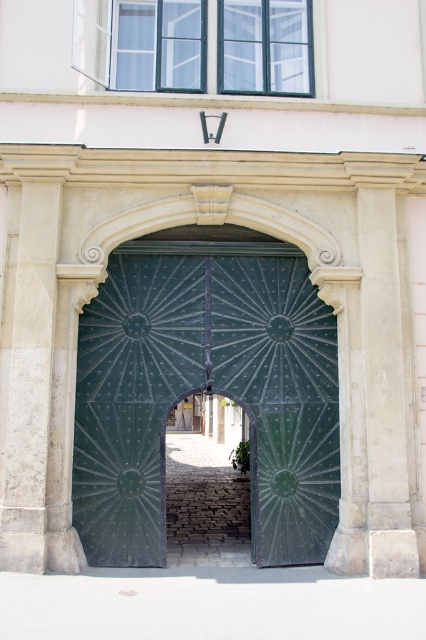
You are standing in front of the grand entrance and want to take a photo of both the white stone pillar at left and the white stone column at right. Which one should you focus on first to ensure both are in the frame?

The white stone pillar at left is positioned on the left side of the white stone column at right, so you should focus on the white stone pillar at left first to ensure both are in the frame.

You are a delivery person standing at the entrance of the building. You need to place a package that is 2 meters long on the ground between the green textured metal door at center and the security camera below the window. Will the package fit without overlapping either object?

The distance between the green textured metal door at center and the security camera below the window is 6.77 meters. Since the package is only 2 meters long, there is enough space for it to fit without overlapping either object.

You are standing in front of the grand entrance of the historic building. There is a point marked at coordinates [207,390]. What object is located at this point?

The point at coordinates [207,390] indicates the green textured metal door at center.